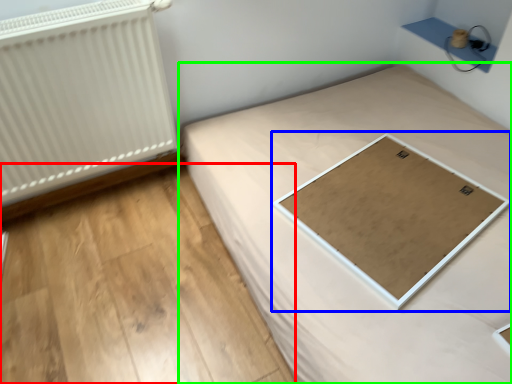
Question: Which object is the farthest from plywood (highlighted by a red box)? Choose among these: table (highlighted by a blue box) or bed (highlighted by a green box).

Choices:
 (A) table
 (B) bed

Answer: (A)